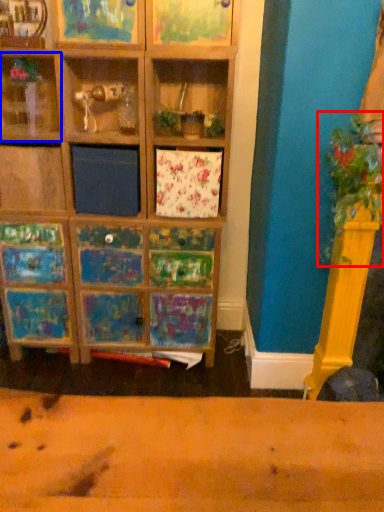
Question: Which point is closer to the camera, plant (highlighted by a red box) or shelf (highlighted by a blue box)?

Choices:
 (A) plant
 (B) shelf

Answer: (A)